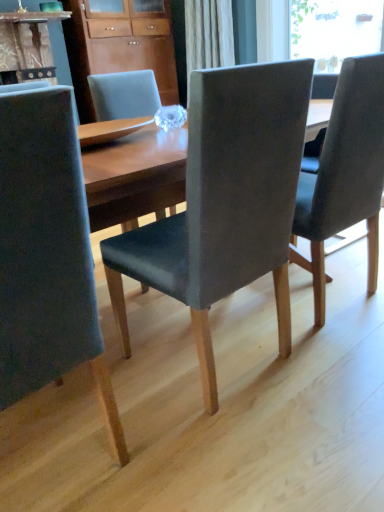
Find the location of a particular element. The height and width of the screenshot is (512, 384). free region under dark gray fabric chair at center, acting as the third chair starting from the left (from a real-world perspective) is located at coordinates (327, 301).